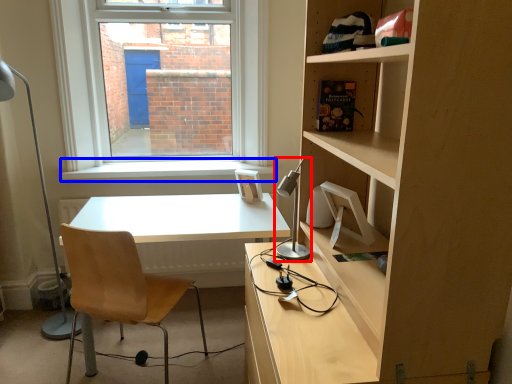
Question: Which point is further to the camera, table lamp (highlighted by a red box) or window sill (highlighted by a blue box)?

Choices:
 (A) table lamp
 (B) window sill

Answer: (B)